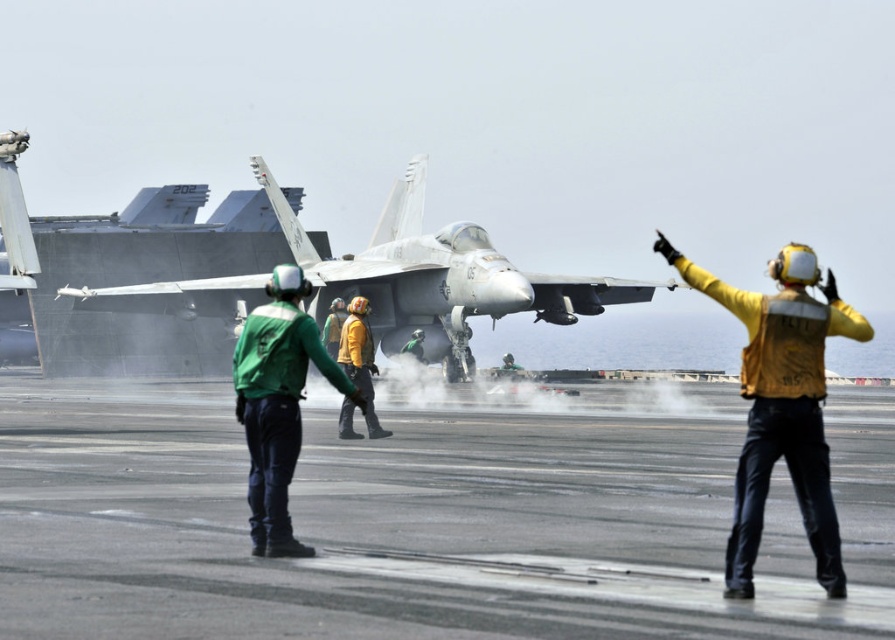
Question: Which point is closer to the camera?

Choices:
 (A) yellow matte jacket at upper right
 (B) green fabric uniform at center

Answer: (A)

Question: Does green fabric uniform at center have a larger size compared to yellow fabric helmet at center?

Choices:
 (A) yes
 (B) no

Answer: (B)

Question: Which object appears closest to the camera in this image?

Choices:
 (A) white matte fighter jet at center
 (B) green fabric uniform at center
 (C) yellow fabric helmet at center
 (D) yellow matte jacket at upper right

Answer: (D)

Question: Can you confirm if yellow matte jacket at upper right is thinner than yellow fabric helmet at center?

Choices:
 (A) yes
 (B) no

Answer: (B)

Question: Which object is positioned closest to the white matte fighter jet at center?

Choices:
 (A) green fabric uniform at center
 (B) yellow fabric helmet at center

Answer: (B)

Question: Can you confirm if white matte fighter jet at center is positioned above green fabric uniform at center?

Choices:
 (A) no
 (B) yes

Answer: (B)